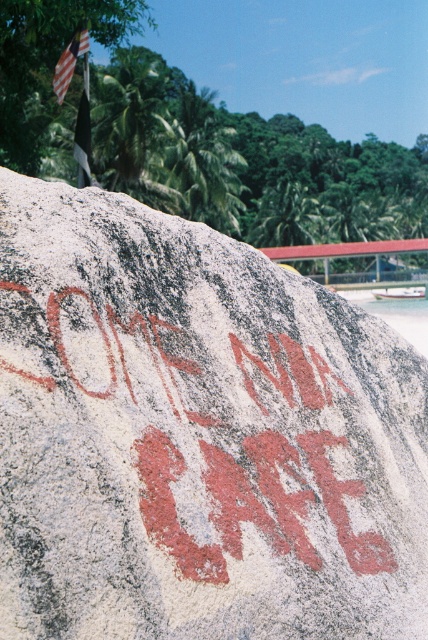
Does point (130, 260) come closer to viewer compared to point (71, 64)?

Yes.

From the picture: Who is more forward, (388,630) or (61,61)?

Point (388,630) is in front.

Where is `reddish-brown stone at center`? The image size is (428, 640). reddish-brown stone at center is located at coordinates (196, 436).